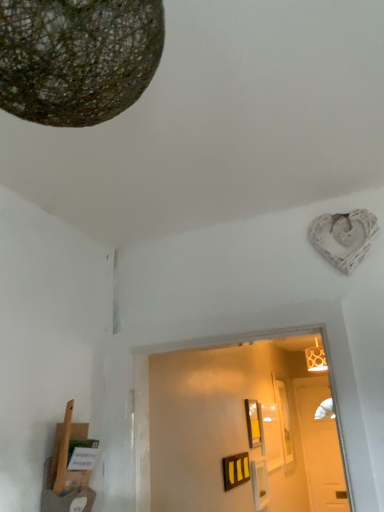
Question: Would you say white wooden door at center is inside or outside textured brown sphere at upper left?

Choices:
 (A) outside
 (B) inside

Answer: (A)

Question: Considering the positions of white wooden door at center and textured brown sphere at upper left in the image, is white wooden door at center wider or thinner than textured brown sphere at upper left?

Choices:
 (A) wide
 (B) thin

Answer: (B)

Question: Considering the real-world distances, which object is closest to the matte yellow picture frame at center?

Choices:
 (A) textured brown sphere at upper left
 (B) white wooden door at center

Answer: (B)

Question: Which object is the closest to the textured brown sphere at upper left?

Choices:
 (A) white wooden door at center
 (B) matte yellow picture frame at center

Answer: (B)